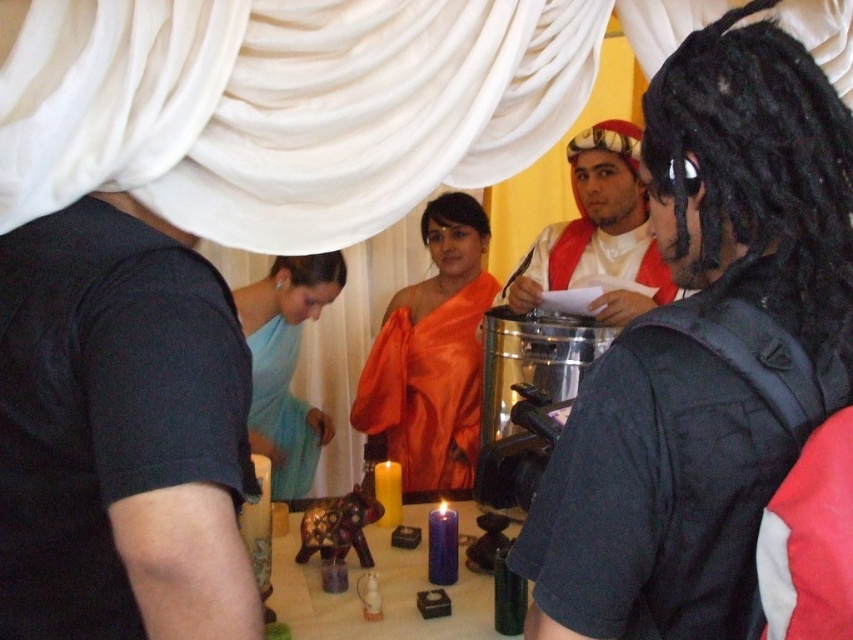
You are an anthropologist observing the scene. You notice the matte red fabric at center and the white silk robe at center. Which object is positioned to the left of the other?

The matte red fabric at center is to the left of the white silk robe at center.

You are an anthropologist observing a cultural ceremony. You notice two items at the center of the scene. Which one is taller between the matte red fabric at center and the white silk robe at center?

The matte red fabric at center is taller than the white silk robe at center.